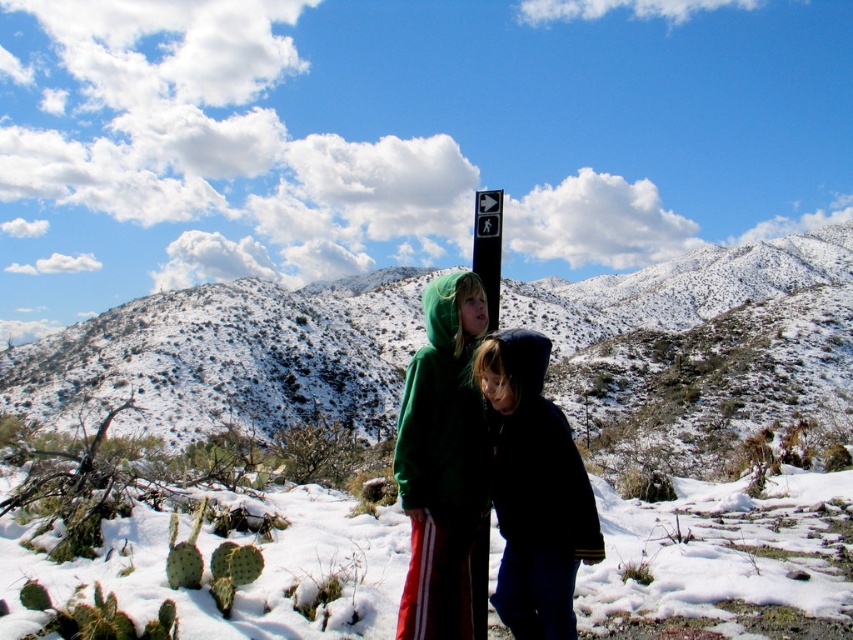
You are planning to take a photo of the snowy rocky mountain at center and the green fleece jackets at center. Which object should you focus on first if you want to include both in the frame without moving the camera?

The snowy rocky mountain at center should be focused on first because its width is larger than the green fleece jackets at center, so it will occupy more space in the frame and ensure both are included properly.

You are a hiker trying to reach the snowy rocky mountain at center. You see the black plastic sign at upper center pointing towards the direction. Based on their positions, which direction should you head relative to the sign?

The snowy rocky mountain at center is to the right of the black plastic sign at upper center, so you should head to the right of the sign to reach the mountain.

Based on the scene description, what are the coordinates of the snowy rocky mountain at center?

The snowy rocky mountain at center is located at coordinates point (227, 358).